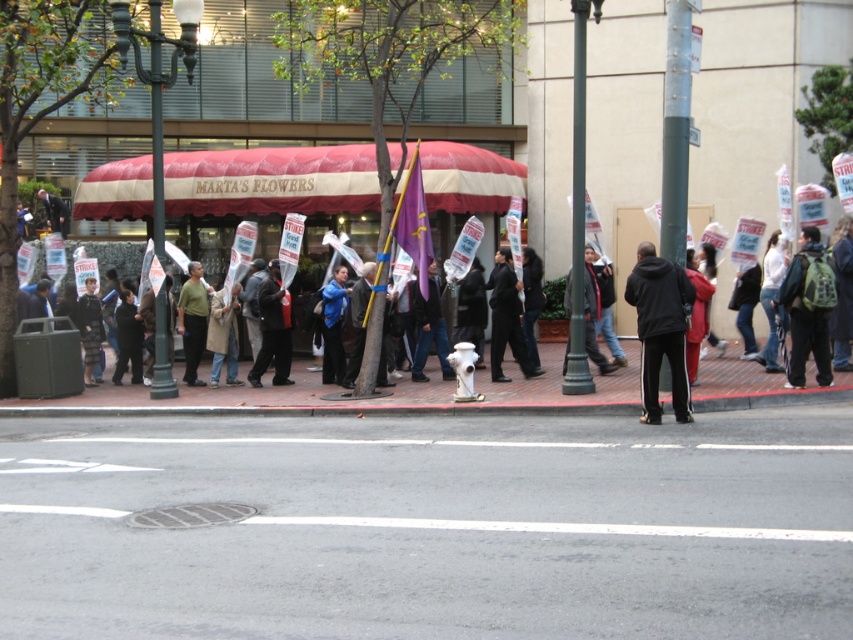
Question: From the image, what is the correct spatial relationship of gray asphalt at lower center in relation to dark blue jeans at center?

Choices:
 (A) above
 (B) below

Answer: (B)

Question: Based on their relative distances, which object is farther from the white cotton shirt at center?

Choices:
 (A) matte green shirt at center
 (B) green backpack at right

Answer: (A)

Question: Which point appears closest to the camera in this image?

Choices:
 (A) (235, 374)
 (B) (416, 369)
 (C) (569, 385)

Answer: (C)

Question: Among these objects, which one is farthest from the camera?

Choices:
 (A) black hoodie at center
 (B) tan leather coat at center
 (C) black metal pole at center
 (D) green backpack at right

Answer: (B)

Question: Does black metal pole at center have a larger size compared to white cotton shirt at center?

Choices:
 (A) no
 (B) yes

Answer: (B)

Question: Does green backpack at right have a larger size compared to tan leather coat at center?

Choices:
 (A) no
 (B) yes

Answer: (B)